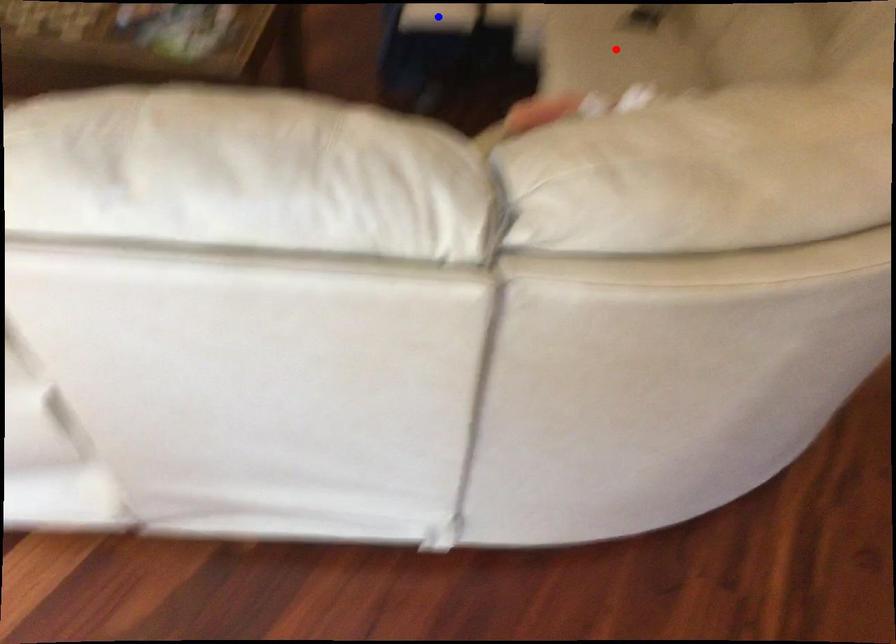
Question: In the image, two points are highlighted. Which point is nearer to the camera? Reply with the corresponding letter.

Choices:
 (A) blue point
 (B) red point

Answer: (B)